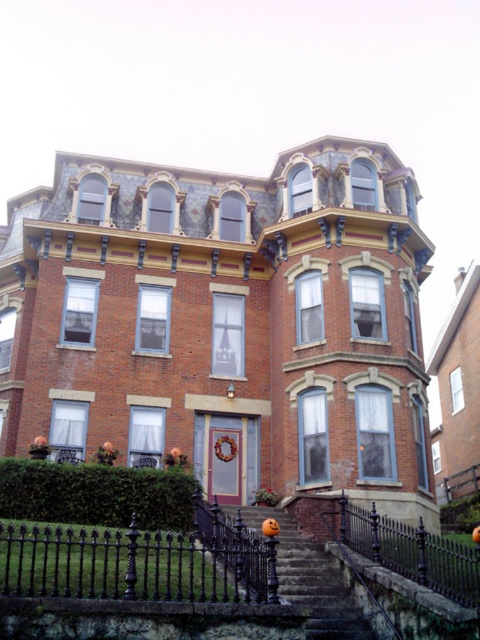
Looking at this image, who is taller, green leafy hedge at lower left or smooth stone stairs at center?

green leafy hedge at lower left is taller.

Identify the location of green leafy hedge at lower left. The image size is (480, 640). (96, 493).

At what (x,y) coordinates should I click in order to perform the action: click on green leafy hedge at lower left. Please return your answer as a coordinate pair (x, y). This screenshot has height=640, width=480. Looking at the image, I should click on (96, 493).

Can you confirm if green leafy hedge at lower left is smaller than black wrought iron fence at lower right?

Indeed, green leafy hedge at lower left has a smaller size compared to black wrought iron fence at lower right.

Does green leafy hedge at lower left come in front of black wrought iron fence at lower right?

That is False.

What do you see at coordinates (96, 493) in the screenshot?
I see `green leafy hedge at lower left` at bounding box center [96, 493].

Locate an element on the screen. green leafy hedge at lower left is located at coordinates (96, 493).

The image size is (480, 640). Describe the element at coordinates (111, 563) in the screenshot. I see `black wrought iron fence at lower center` at that location.

Is black wrought iron fence at lower center positioned before green leafy hedge at lower left?

Yes, black wrought iron fence at lower center is in front of green leafy hedge at lower left.

Who is more forward, (x=204, y=580) or (x=124, y=502)?

Positioned in front is point (x=204, y=580).

Identify the location of black wrought iron fence at lower center. (111, 563).